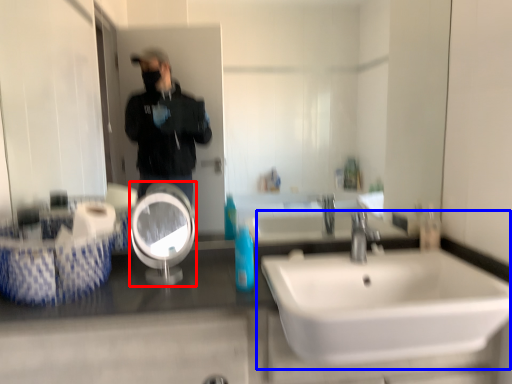
Question: Which object appears farthest to the camera in this image, reflection (highlighted by a red box) or sink (highlighted by a blue box)?

Choices:
 (A) reflection
 (B) sink

Answer: (A)